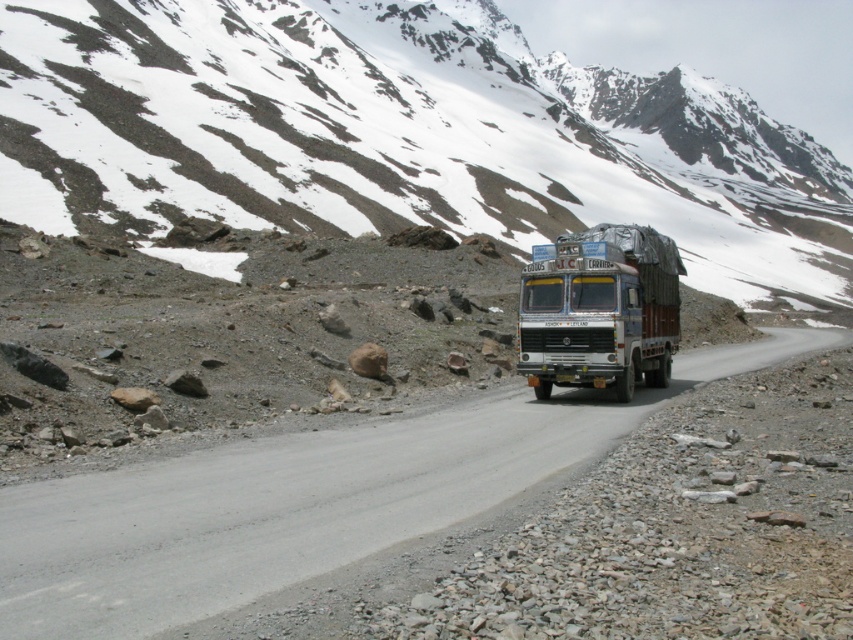
Does snowy rock at upper center come behind metallic blue trailer truck at center?

Yes, snowy rock at upper center is behind metallic blue trailer truck at center.

Is snowy rock at upper center to the right of metallic blue trailer truck at center from the viewer's perspective?

Correct, you'll find snowy rock at upper center to the right of metallic blue trailer truck at center.

Which is in front, point (457, 221) or point (556, 317)?

Point (556, 317)

Locate an element on the screen. snowy rock at upper center is located at coordinates (398, 134).

Is the position of snowy rock at upper center less distant than that of gray asphalt road at center?

No, snowy rock at upper center is further to the viewer.

Is point (456, 6) closer to viewer compared to point (143, 540)?

No, (456, 6) is further to viewer.

Who is more distant from viewer, (x=387, y=109) or (x=42, y=500)?

The point (x=387, y=109) is more distant.

Identify the location of snowy rock at upper center. This screenshot has width=853, height=640. (398, 134).

Is gray asphalt road at center to the right of metallic blue trailer truck at center from the viewer's perspective?

No, gray asphalt road at center is not to the right of metallic blue trailer truck at center.

Is gray asphalt road at center taller than metallic blue trailer truck at center?

Incorrect, gray asphalt road at center's height is not larger of metallic blue trailer truck at center's.

Who is more forward, (x=199, y=472) or (x=610, y=328)?

Positioned in front is point (x=199, y=472).

Identify the location of gray asphalt road at center. (270, 512).